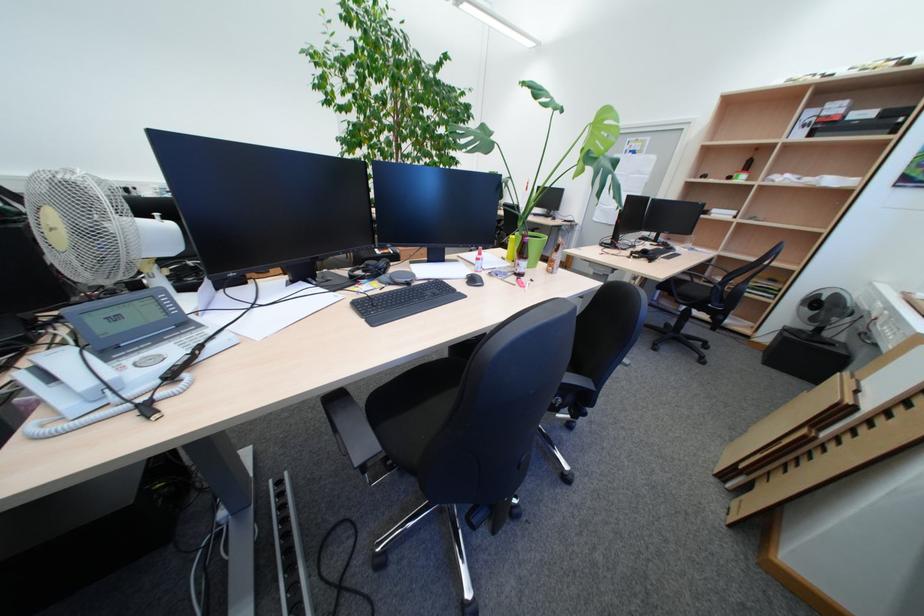
Locate an element on the screen. The height and width of the screenshot is (616, 924). green glass bottle is located at coordinates (517, 243).